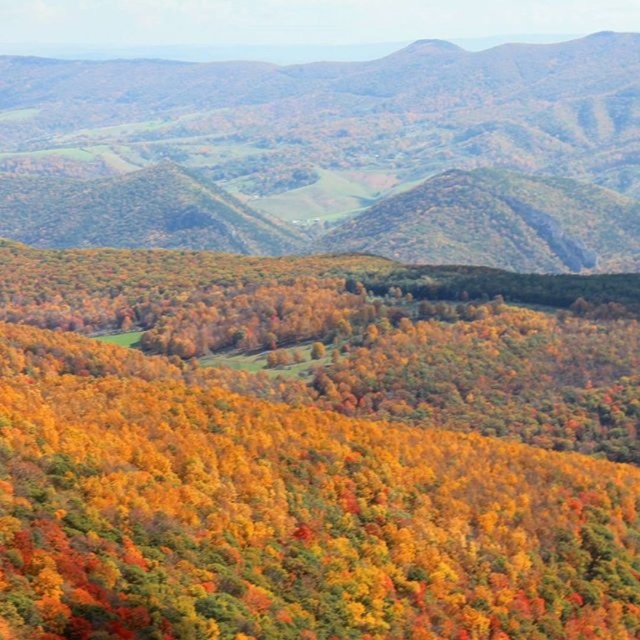
You are a hiker planning to take a photo of both the autumn leaves forest at center and the green leafy forest at center. Based on their sizes, which forest should you focus on first to ensure both fit in your camera frame?

The autumn leaves forest at center is smaller than the green leafy forest at center, so you should focus on capturing the smaller autumn leaves forest at center first to ensure both fit within the camera frame.

You are a hiker standing in the valley below the image. You see the autumn leaves forest at center and the green leafy forest at center. Which forest is located to the right side from your perspective?

The autumn leaves forest at center is to the right of the green leafy forest at center, so from your perspective in the valley, the autumn leaves forest at center is on the right side.